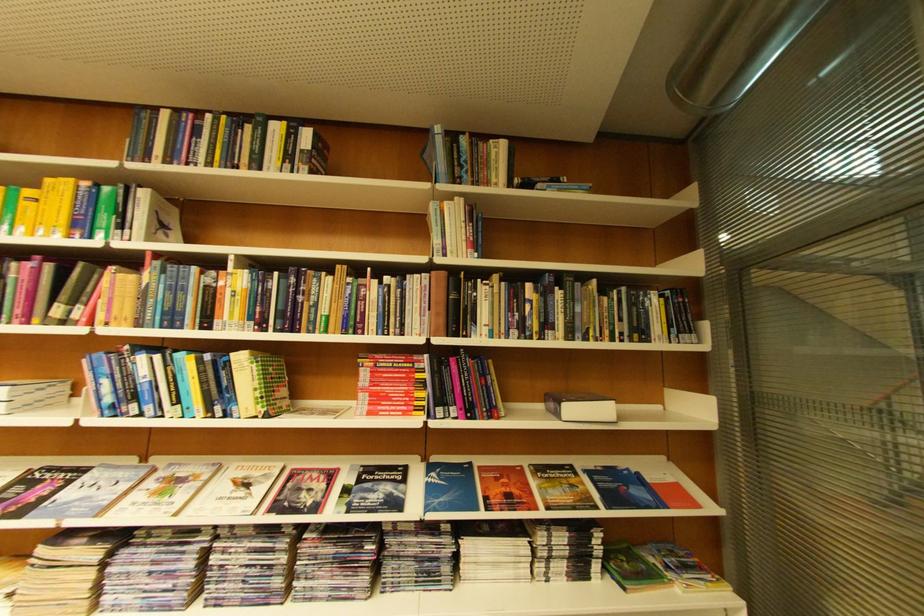
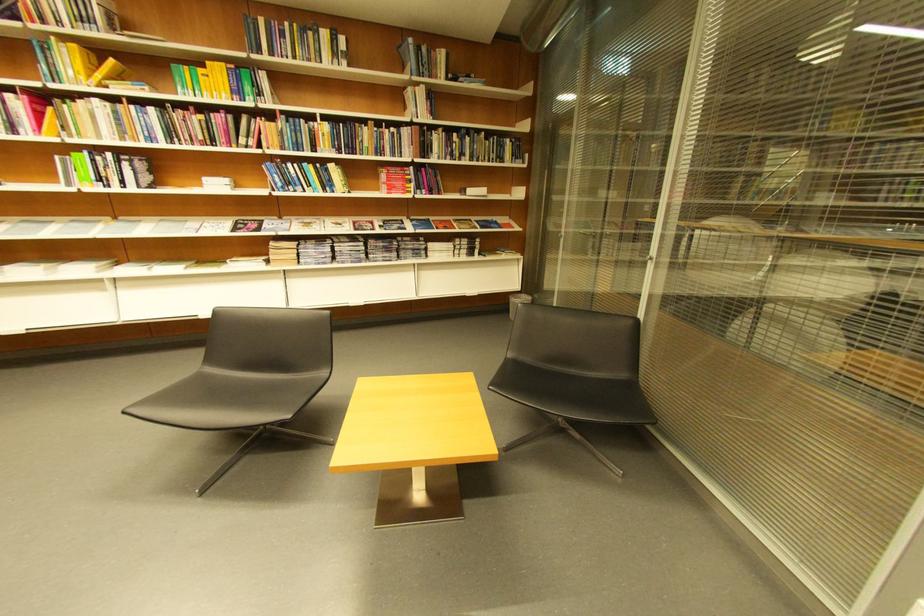
Where in the second image is the point corresponding to (x=485, y=184) from the first image?

(441, 78)